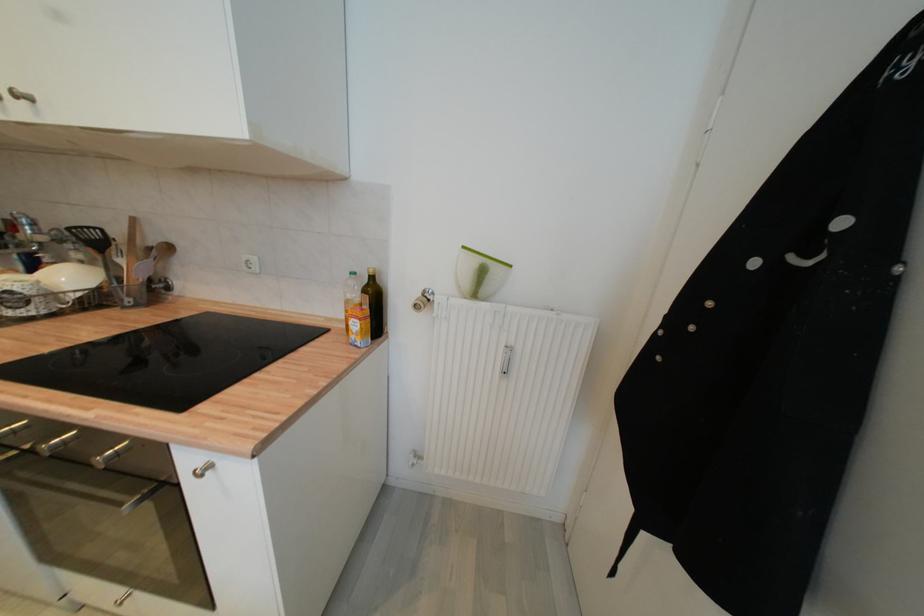
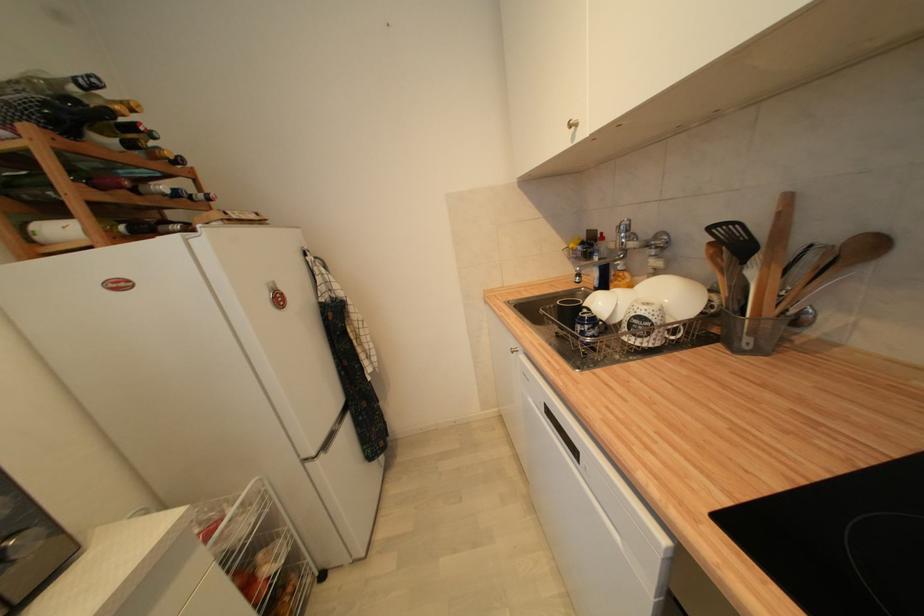
Locate, in the second image, the point that corresponds to (x=39, y=225) in the first image.

(633, 233)